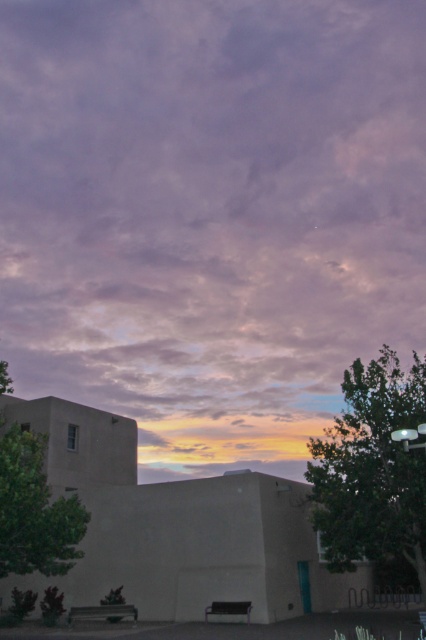
You are standing in the serene outdoor scene described. There is a purple matte cloud at upper center represented by point [210,214]. Can you tell me the coordinates of the purple matte cloud at upper center?

The purple matte cloud at upper center is represented by point [210,214].

Consider the image. You are an architect designing a new building and want to ensure it fits harmoniously with the existing structures in the scene. The new building must be placed between the purple matte cloud at upper center and the green leafy tree at right. Which object should the new building be closer to in terms of width to maintain visual balance?

The purple matte cloud at upper center has a greater width than the green leafy tree at right. To maintain visual balance, the new building should be closer to the purple matte cloud at upper center so that its width contrasts appropriately with the wider cloud and complements the narrower tree.

You are standing in front of the lowrise building and looking towards the horizon. Which object, the purple matte cloud at upper center or the green leafy tree at left, is positioned to the right of the other?

The purple matte cloud at upper center is positioned to the right of the green leafy tree at left.